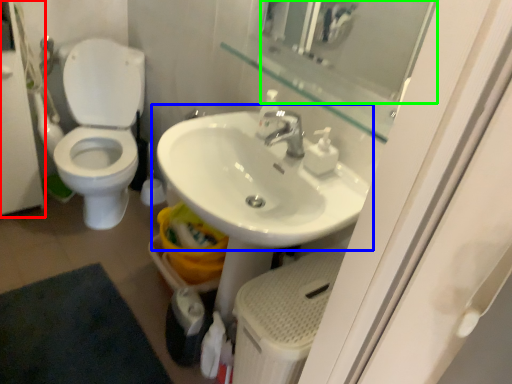
Question: Based on their relative distances, which object is nearer to screen door (highlighted by a red box)? Choose from sink (highlighted by a blue box) and mirror (highlighted by a green box).

Choices:
 (A) sink
 (B) mirror

Answer: (A)